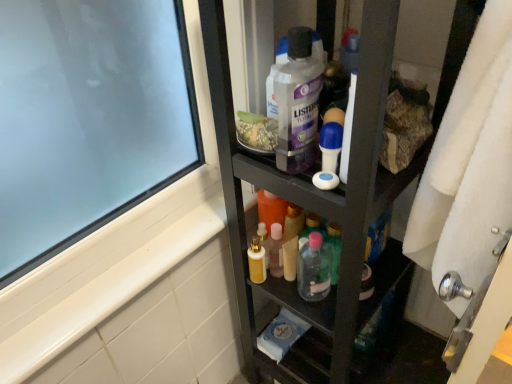
Question: Is white matte soap at center far away from white fluffy bath towel at right?

Choices:
 (A) yes
 (B) no

Answer: (B)

Question: Does white matte soap at center have a greater width compared to white fluffy bath towel at right?

Choices:
 (A) yes
 (B) no

Answer: (B)

Question: From the image's perspective, is white matte soap at center under white fluffy bath towel at right?

Choices:
 (A) no
 (B) yes

Answer: (A)

Question: From a real-world perspective, is white matte soap at center below white fluffy bath towel at right?

Choices:
 (A) yes
 (B) no

Answer: (B)

Question: Would you say white matte soap at center contains white fluffy bath towel at right?

Choices:
 (A) no
 (B) yes

Answer: (A)

Question: Can you confirm if white matte soap at center is thinner than white fluffy bath towel at right?

Choices:
 (A) yes
 (B) no

Answer: (A)

Question: From a real-world perspective, is black matte cabinet at center on top of white plastic roll-on deodorant at center, placed as the second toiletry when sorted from bottom to top?

Choices:
 (A) yes
 (B) no

Answer: (B)

Question: Is black matte cabinet at center further to camera compared to white plastic roll-on deodorant at center, the second toiletry when ordered from back to front?

Choices:
 (A) no
 (B) yes

Answer: (A)

Question: Is black matte cabinet at center next to white plastic roll-on deodorant at center, which appears as the 1th toiletry when viewed from the top?

Choices:
 (A) yes
 (B) no

Answer: (B)

Question: Is white plastic roll-on deodorant at center, placed as the second toiletry when sorted from bottom to top, at the back of black matte cabinet at center?

Choices:
 (A) yes
 (B) no

Answer: (A)

Question: Is there a large distance between black matte cabinet at center and white plastic roll-on deodorant at center, the second toiletry when ordered from back to front?

Choices:
 (A) no
 (B) yes

Answer: (A)

Question: Is black matte cabinet at center closer to camera compared to white plastic roll-on deodorant at center, the second toiletry when ordered from back to front?

Choices:
 (A) yes
 (B) no

Answer: (A)

Question: Is clear plastic mouthwash at center shorter than white fluffy bath towel at right?

Choices:
 (A) no
 (B) yes

Answer: (B)